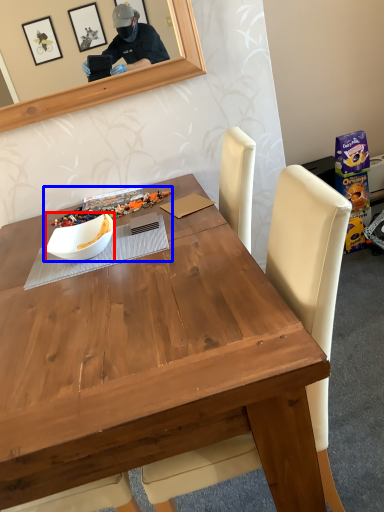
Question: Which of the following is the farthest to the observer, bowl (highlighted by a red box) or fruit dish (highlighted by a blue box)?

Choices:
 (A) bowl
 (B) fruit dish

Answer: (B)